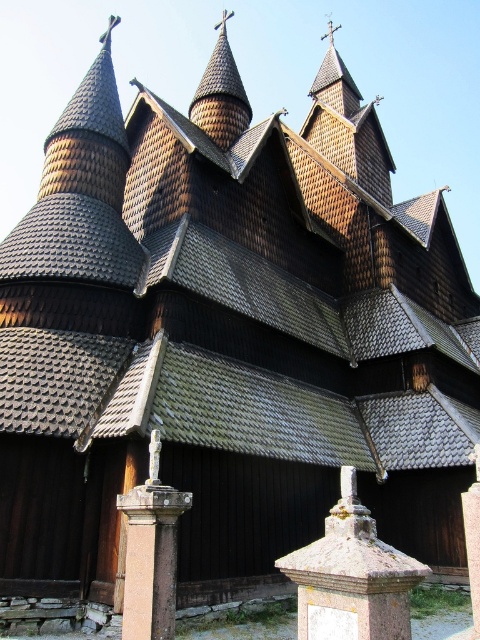
Question: Which object appears farthest from the camera in this image?

Choices:
 (A) dark brown wood spire at upper center
 (B) smooth stone pillar at center
 (C) rusty stone post at center
 (D) pink stone pillar at lower center

Answer: (A)

Question: Can you confirm if pink stone pillar at lower center is thinner than smooth stone pillar at center?

Choices:
 (A) no
 (B) yes

Answer: (B)

Question: Which point appears closest to the camera in this image?

Choices:
 (A) (363, 564)
 (B) (120, 500)
 (C) (465, 525)

Answer: (A)

Question: Does dark brown wood spire at upper center have a larger size compared to smooth stone pillar at center?

Choices:
 (A) no
 (B) yes

Answer: (B)

Question: Estimate the real-world distances between objects in this image. Which object is farther from the dark brown wood spire at upper center?

Choices:
 (A) pink stone pillar at lower center
 (B) smooth stone pillar at center

Answer: (A)

Question: Can you confirm if rusty stone post at center is positioned to the right of dark brown wood spire at upper center?

Choices:
 (A) yes
 (B) no

Answer: (A)